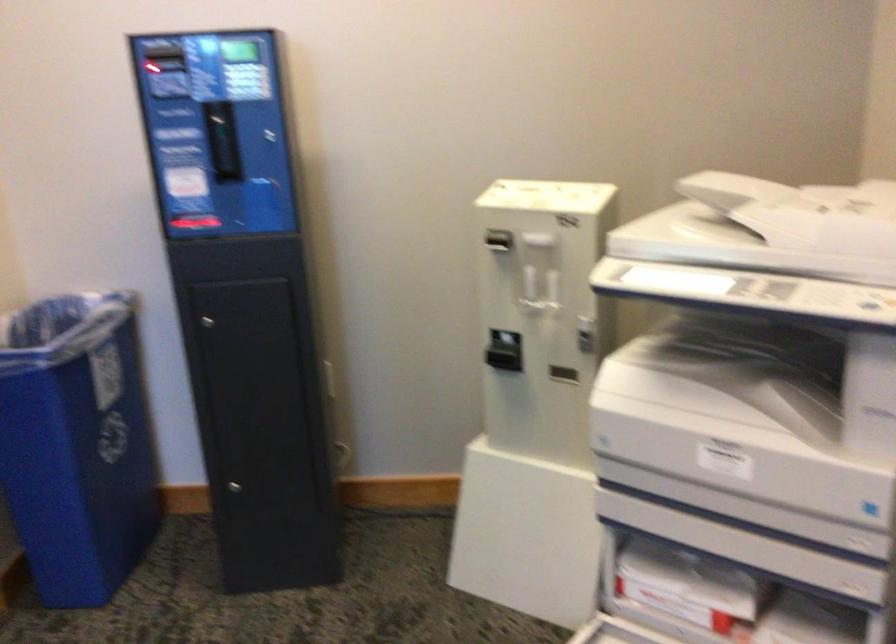
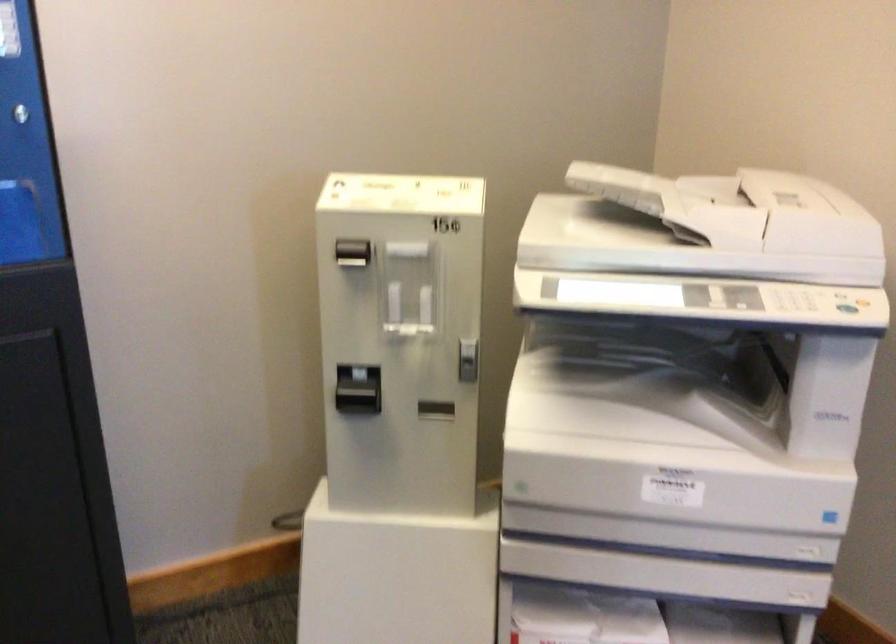
Which direction would the cameraman need to move to produce the second image?

The cameraman walked toward left, forward.